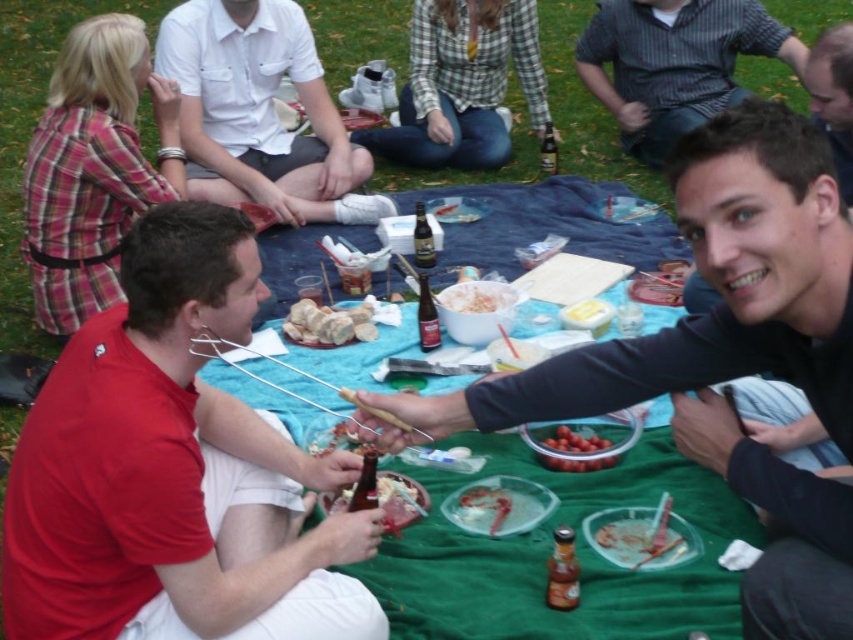
Question: Is striped cotton shirt at upper right bigger than translucent plastic plate at lower center?

Choices:
 (A) no
 (B) yes

Answer: (B)

Question: Which of the following is the farthest from the observer?

Choices:
 (A) white cotton shirt at upper center
 (B) smooth black hair at upper right

Answer: (A)

Question: Which object is positioned farthest from the white cotton shirt at upper center?

Choices:
 (A) white crumbly bread at center
 (B) smooth black hair at upper right

Answer: (B)

Question: Can you confirm if smooth black shirt at center is positioned below smooth black hair at upper right?

Choices:
 (A) yes
 (B) no

Answer: (A)

Question: Which of the following is the closest to the observer?

Choices:
 (A) smooth black shirt at center
 (B) translucent plastic plate at center
 (C) meat at center

Answer: (A)

Question: Can you confirm if red matte shirt at left is smaller than meat at center?

Choices:
 (A) yes
 (B) no

Answer: (B)